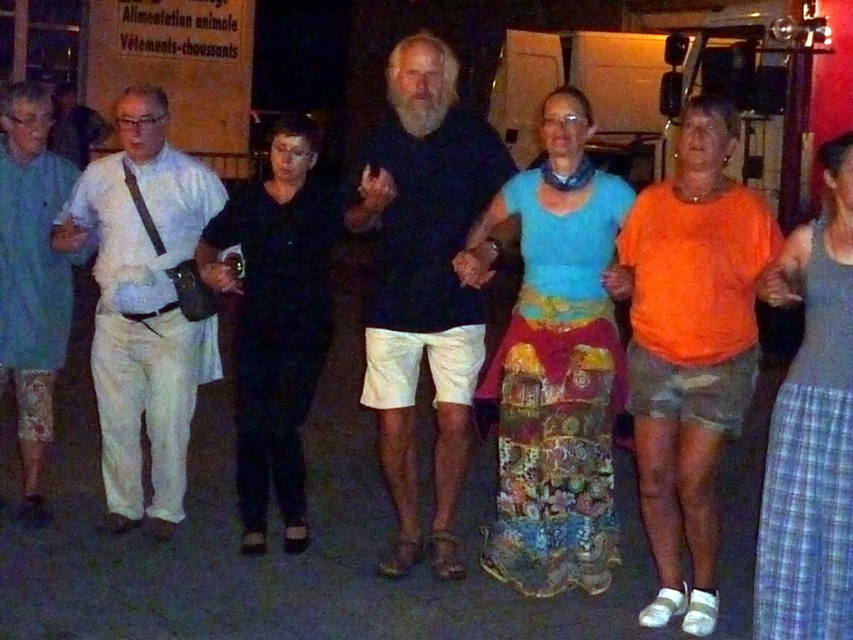
Question: Does white cotton shirt at left have a smaller size compared to light blue cotton shirt at left?

Choices:
 (A) no
 (B) yes

Answer: (A)

Question: Considering the real-world distances, which object is closest to the black matte pants at center?

Choices:
 (A) orange cotton shirt at right
 (B) blue cotton shirt at center

Answer: (B)

Question: Does blue cotton shirt at center appear under orange cotton shirt at right?

Choices:
 (A) no
 (B) yes

Answer: (A)

Question: Which of the following is the closest to the observer?

Choices:
 (A) light blue cotton shirt at left
 (B) orange cotton shirt at right
 (C) gray plaid skirt at lower right
 (D) blue cotton shirt at center

Answer: (C)

Question: Which object is positioned closest to the orange cotton shirt at right?

Choices:
 (A) black matte pants at center
 (B) blue cotton shirt at center

Answer: (B)

Question: Does blue cotton shirt at center appear on the right side of light blue cotton shirt at left?

Choices:
 (A) yes
 (B) no

Answer: (A)